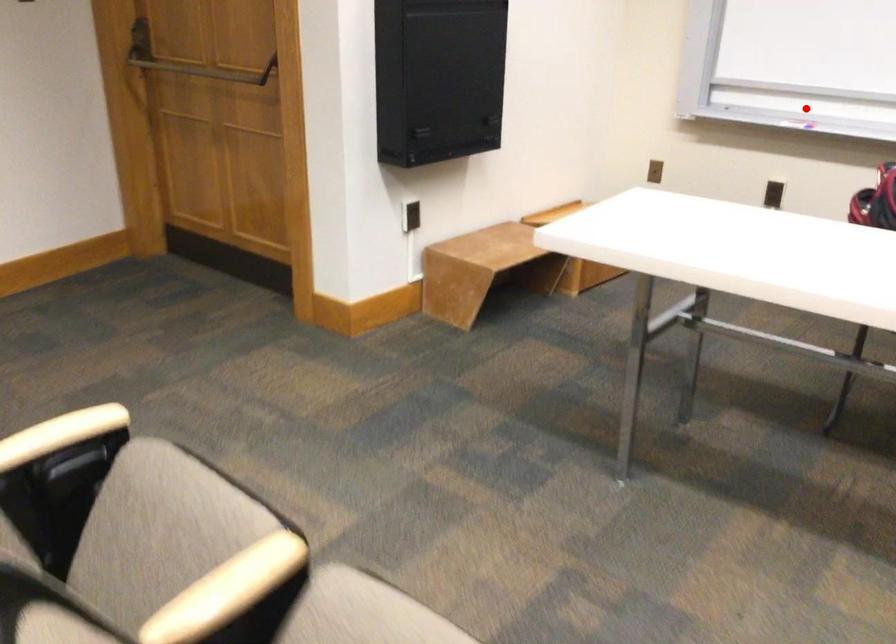
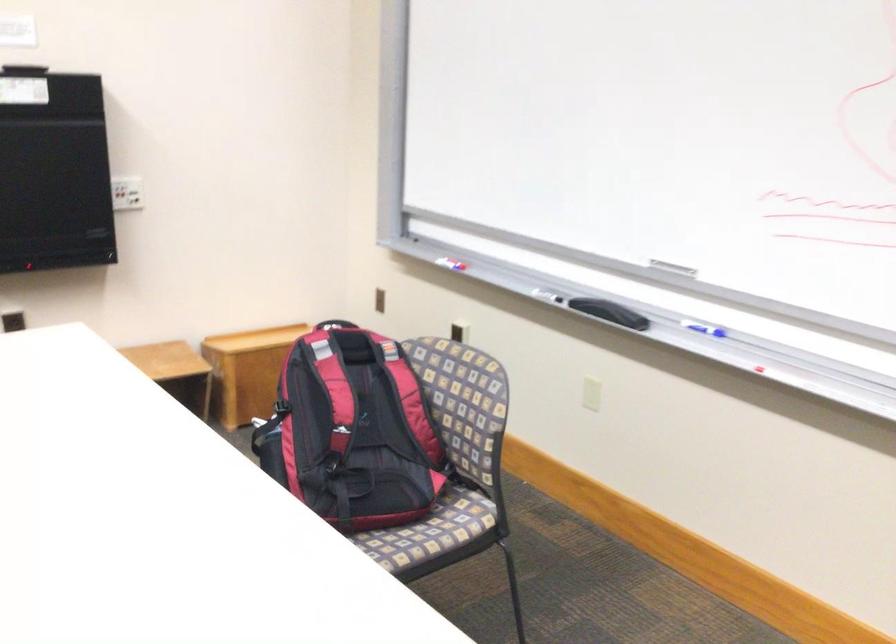
The point at the highlighted location is marked in the first image. Where is the corresponding point in the second image?

(451, 261)